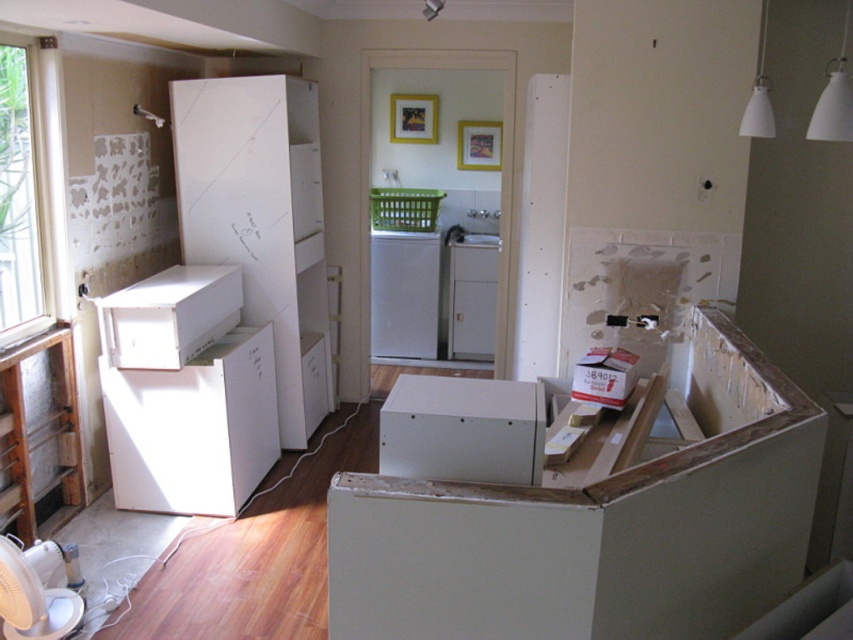
Is white glossy refrigerator at center positioned before white cardboard box at center?

That is False.

Looking at this image, measure the distance between white glossy refrigerator at center and white cardboard box at center.

They are 7.87 feet apart.

Locate an element on the screen. The width and height of the screenshot is (853, 640). white glossy refrigerator at center is located at coordinates (473, 296).

Find the location of a particular element. The image size is (853, 640). white glossy refrigerator at center is located at coordinates tap(473, 296).

Is white matte refrigerator at center thinner than white cardboard box at center?

No, white matte refrigerator at center is not thinner than white cardboard box at center.

Which of these two, white matte refrigerator at center or white cardboard box at center, stands shorter?

With less height is white cardboard box at center.

Who is more forward, (397, 236) or (607, 356)?

Point (607, 356)

The image size is (853, 640). Identify the location of white matte refrigerator at center. (404, 294).

Which is below, white matte cardboard box at center or white cardboard box at center?

white matte cardboard box at center is below.

Is white matte cardboard box at center to the left of white cardboard box at center from the viewer's perspective?

Correct, you'll find white matte cardboard box at center to the left of white cardboard box at center.

Is point (526, 403) closer to camera compared to point (595, 392)?

Yes.

The image size is (853, 640). I want to click on white matte cardboard box at center, so click(462, 429).